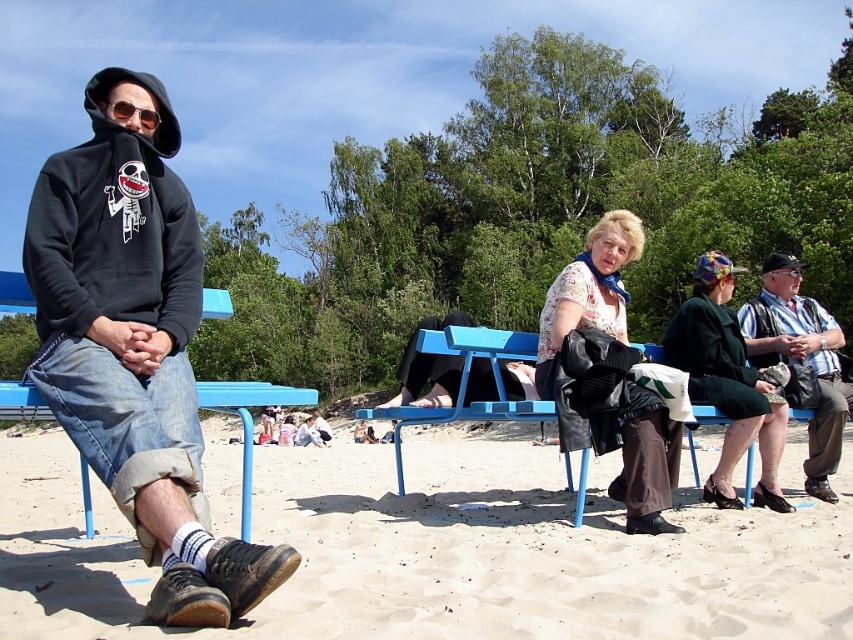
Does brown leather shoes at lower left lie behind black matte hoodie at left?

No, it is in front of black matte hoodie at left.

Between brown leather shoes at lower left and black matte hoodie at left, which one has more height?

Standing taller between the two is brown leather shoes at lower left.

Identify the location of brown leather shoes at lower left. (436, 554).

The width and height of the screenshot is (853, 640). Find the location of `brown leather shoes at lower left`. brown leather shoes at lower left is located at coordinates (436, 554).

Who is shorter, black matte hoodie at left or green fabric vest at right?

With less height is green fabric vest at right.

Does black matte hoodie at left appear over green fabric vest at right?

Correct, black matte hoodie at left is located above green fabric vest at right.

Does point (54, 266) lie in front of point (804, 480)?

That is True.

Where is `black matte hoodie at left`? This screenshot has height=640, width=853. black matte hoodie at left is located at coordinates (84, 216).

Measure the distance between point (773,291) and camera.

Point (773,291) is 27.20 feet from camera.

Between green fabric vest at right and blue plastic bench at left, which one has less height?

With less height is green fabric vest at right.

Which is behind, point (830, 440) or point (85, 509)?

Positioned behind is point (830, 440).

Identify the location of green fabric vest at right. (801, 362).